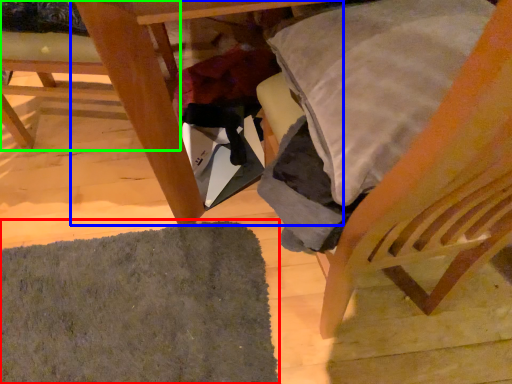
Question: Considering the real-world distances, which object is closest to mat (highlighted by a red box)? table (highlighted by a blue box) or chair (highlighted by a green box).

Choices:
 (A) table
 (B) chair

Answer: (A)